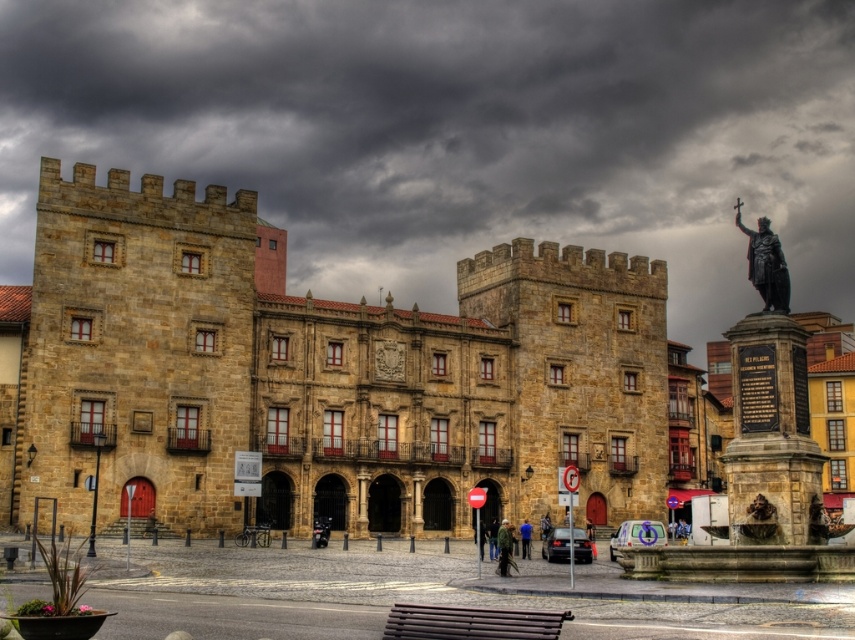
Is brown stone castle at center to the left of green fabric jacket at center from the viewer's perspective?

Indeed, brown stone castle at center is positioned on the left side of green fabric jacket at center.

From the picture: Can you confirm if brown stone castle at center is thinner than green fabric jacket at center?

In fact, brown stone castle at center might be wider than green fabric jacket at center.

Find the location of a particular element. The image size is (855, 640). brown stone castle at center is located at coordinates (316, 374).

This screenshot has height=640, width=855. What are the coordinates of `brown stone castle at center` in the screenshot? It's located at (316, 374).

The height and width of the screenshot is (640, 855). What do you see at coordinates (470, 621) in the screenshot? I see `brown wooden bench at lower center` at bounding box center [470, 621].

Is brown wooden bench at lower center to the right of blue fabric jacket at center from the viewer's perspective?

No, brown wooden bench at lower center is not to the right of blue fabric jacket at center.

At what (x,y) coordinates should I click in order to perform the action: click on brown wooden bench at lower center. Please return your answer as a coordinate pair (x, y). The height and width of the screenshot is (640, 855). Looking at the image, I should click on (470, 621).

The width and height of the screenshot is (855, 640). I want to click on brown wooden bench at lower center, so click(x=470, y=621).

Between point (506, 554) and point (519, 525), which one is positioned in front?

Point (506, 554)

Does green fabric jacket at center appear over blue fabric jacket at center?

Yes.

Find the location of a particular element. Image resolution: width=855 pixels, height=640 pixels. green fabric jacket at center is located at coordinates (504, 547).